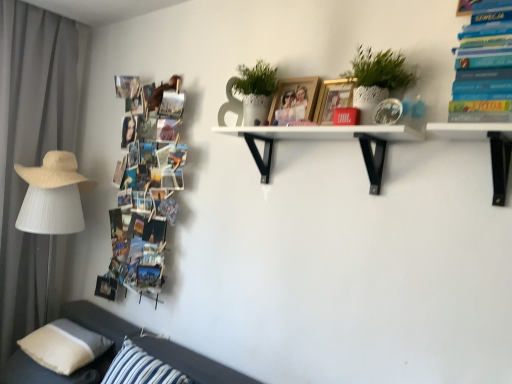
Identify the location of free region under white textured pot at upper center (from a real-world perspective). (376, 131).